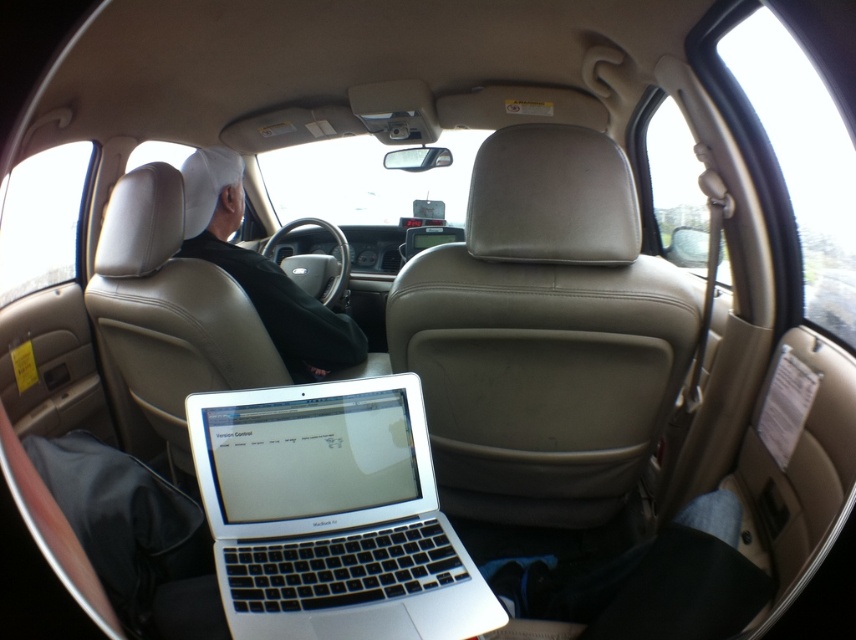
Question: Is silver metallic laptop at center closer to camera compared to white leather jacket at upper left?

Choices:
 (A) no
 (B) yes

Answer: (B)

Question: From the image, what is the correct spatial relationship of silver metallic laptop at center in relation to white leather jacket at upper left?

Choices:
 (A) left
 (B) right

Answer: (B)

Question: Which point appears farthest from the camera in this image?

Choices:
 (A) (218, 252)
 (B) (403, 438)

Answer: (A)

Question: Which point appears farthest from the camera in this image?

Choices:
 (A) (253, 292)
 (B) (461, 609)

Answer: (A)

Question: Is silver metallic laptop at center bigger than white leather jacket at upper left?

Choices:
 (A) no
 (B) yes

Answer: (A)